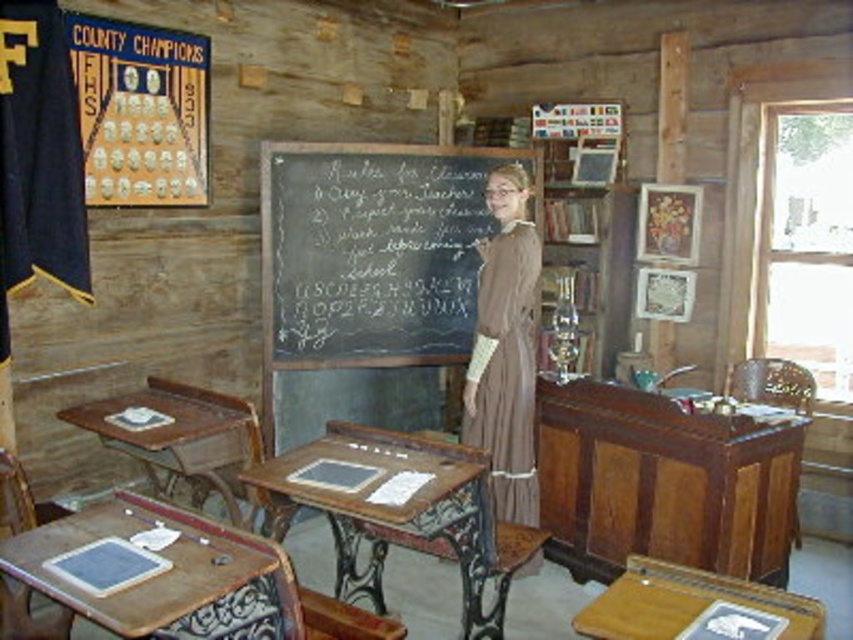
You are a student in this classroom and need to sit down to write. You see the wooden desk at lower left and the wooden chair at right. Which one should you choose to sit on?

You should choose the wooden chair at right to sit on because the wooden desk at lower left is taller than the wooden chair at right, making the chair the appropriate seating option.

You are standing in the vintage classroom and want to move from point A to point B. Point A is located at coordinates point (473, 529) and point B is at point (13, 593). Since you need to navigate through the desks and other furniture, will you have to move closer to or further away from the classroom entrance while going from point A to point B?

Point (473, 529) is further to the viewer than point (13, 593). Therefore, moving from point A to point B requires moving further away from the classroom entrance, as point B is closer to the entrance compared to point A.